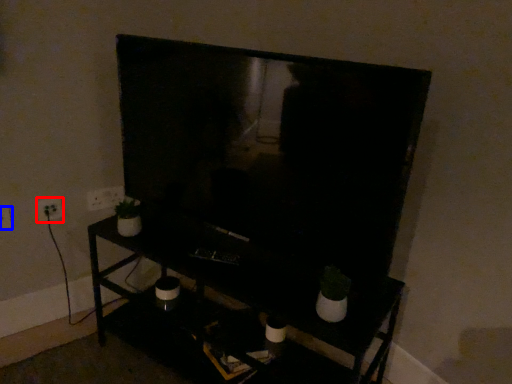
Question: Which point is further to the camera, electric outlet (highlighted by a red box) or electric outlet (highlighted by a blue box)?

Choices:
 (A) electric outlet
 (B) electric outlet

Answer: (A)